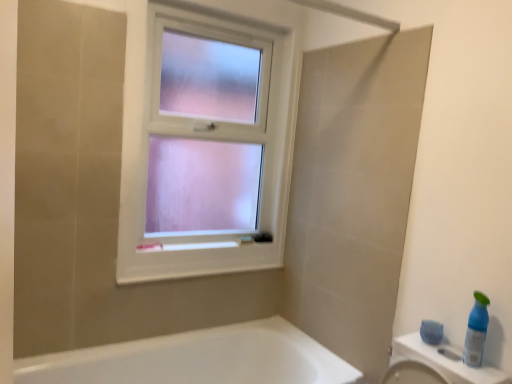
What do you see at coordinates (476, 331) in the screenshot? This screenshot has height=384, width=512. I see `blue plastic spray bottle at right` at bounding box center [476, 331].

Where is `blue plastic spray bottle at right`? This screenshot has height=384, width=512. blue plastic spray bottle at right is located at coordinates (476, 331).

Image resolution: width=512 pixels, height=384 pixels. I want to click on blue plastic spray bottle at right, so click(476, 331).